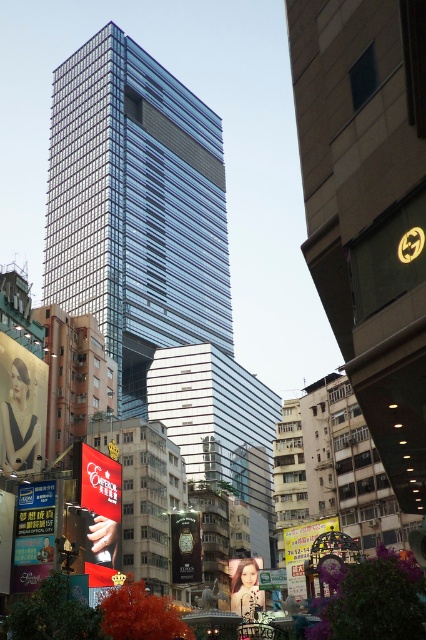
Question: Which of the following is the closest to the observer?

Choices:
 (A) (25, 452)
 (B) (371, 61)
 (C) (88, 484)
 (D) (301, 554)

Answer: (B)

Question: Among these points, which one is nearest to the camera?

Choices:
 (A) (333, 204)
 (B) (40, 541)
 (C) (301, 561)
 (D) (244, 589)

Answer: (A)

Question: Can you confirm if glassy metallic skyscraper at center is positioned to the right of blue glossy billboard at lower left?

Choices:
 (A) yes
 (B) no

Answer: (A)

Question: In this image, where is transparent glass tower at center located relative to matte plastic billboard at center?

Choices:
 (A) right
 (B) left

Answer: (B)

Question: Is matte red billboard at lower left to the left of metallic gold watch at center from the viewer's perspective?

Choices:
 (A) no
 (B) yes

Answer: (B)

Question: Considering the real-world distances, which object is farthest from the metallic gold watch at center?

Choices:
 (A) glassy metallic skyscraper at center
 (B) transparent glass tower at center
 (C) blue glossy billboard at lower left

Answer: (B)